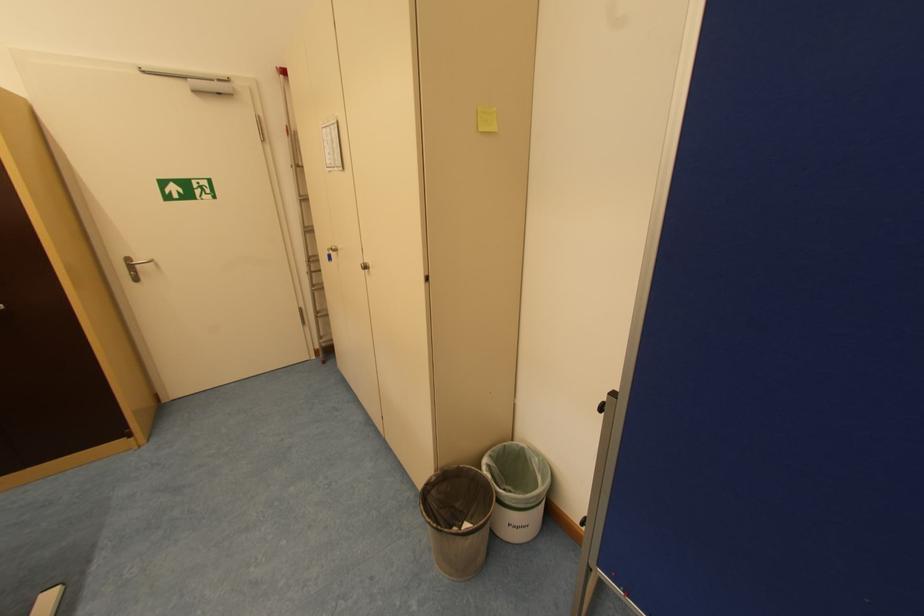
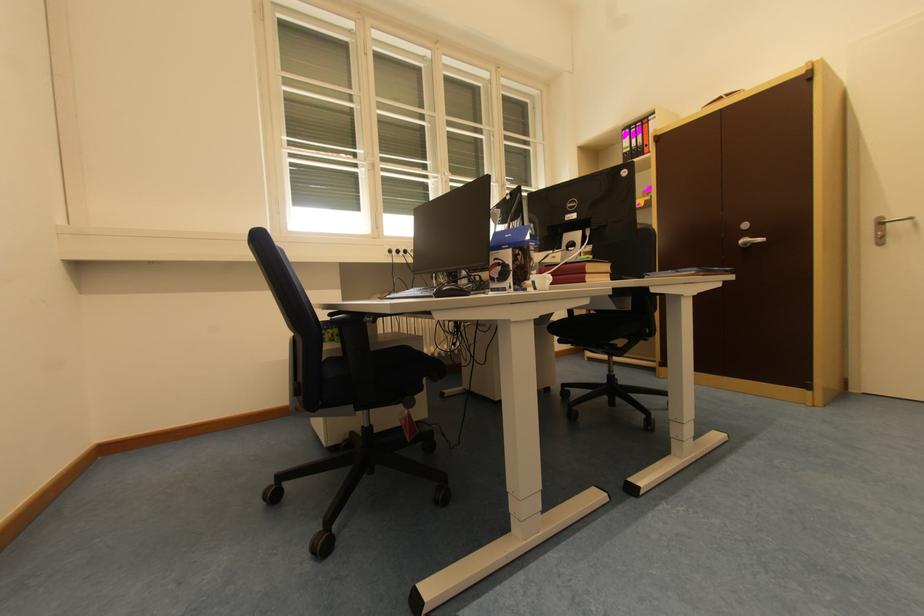
Question: The camera is either moving clockwise (left) or counter-clockwise (right) around the object. The first image is from the beginning of the video and the second image is from the end. Is the camera moving left or right when shooting the video?

Choices:
 (A) Left
 (B) Right

Answer: (B)